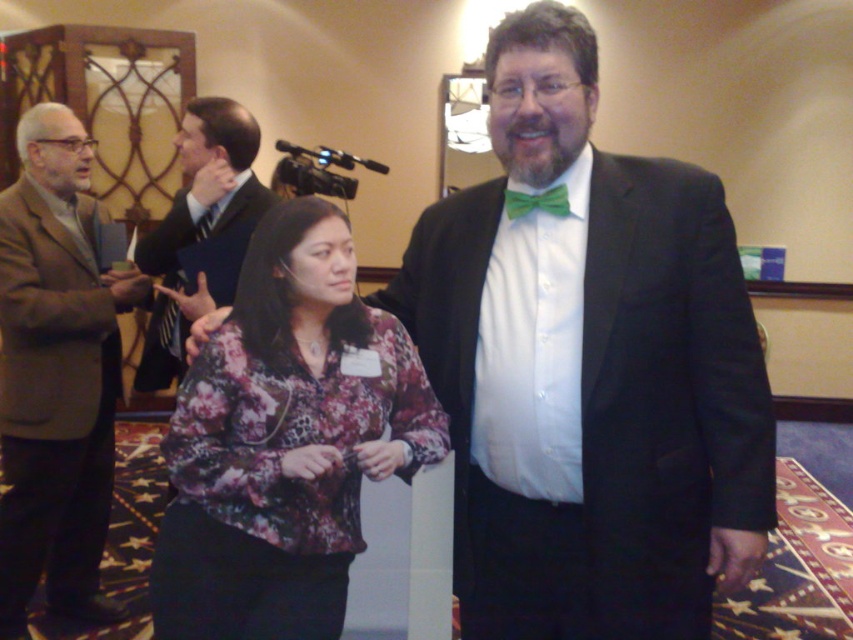
Question: Estimate the real-world distances between objects in this image. Which object is closer to the dark gray suit at center?

Choices:
 (A) black plastic video camera at upper center
 (B) brown woolen suit at left
 (C) green satin bow tie at center

Answer: (C)

Question: Does brown woolen suit at left have a smaller size compared to black plastic video camera at upper center?

Choices:
 (A) yes
 (B) no

Answer: (B)

Question: Estimate the real-world distances between objects in this image. Which object is farther from the green satin bow tie at center?

Choices:
 (A) brown woolen suit at left
 (B) dark gray suit at center
 (C) floral print blouse at center
 (D) black plastic video camera at upper center

Answer: (D)

Question: Among these objects, which one is farthest from the camera?

Choices:
 (A) green satin bow tie at center
 (B) black plastic video camera at upper center
 (C) dark gray suit at center
 (D) dark blue sweater at center

Answer: (B)

Question: Does floral print blouse at center come behind brown woolen suit at left?

Choices:
 (A) no
 (B) yes

Answer: (A)

Question: Does floral print blouse at center have a larger size compared to dark gray suit at center?

Choices:
 (A) yes
 (B) no

Answer: (A)